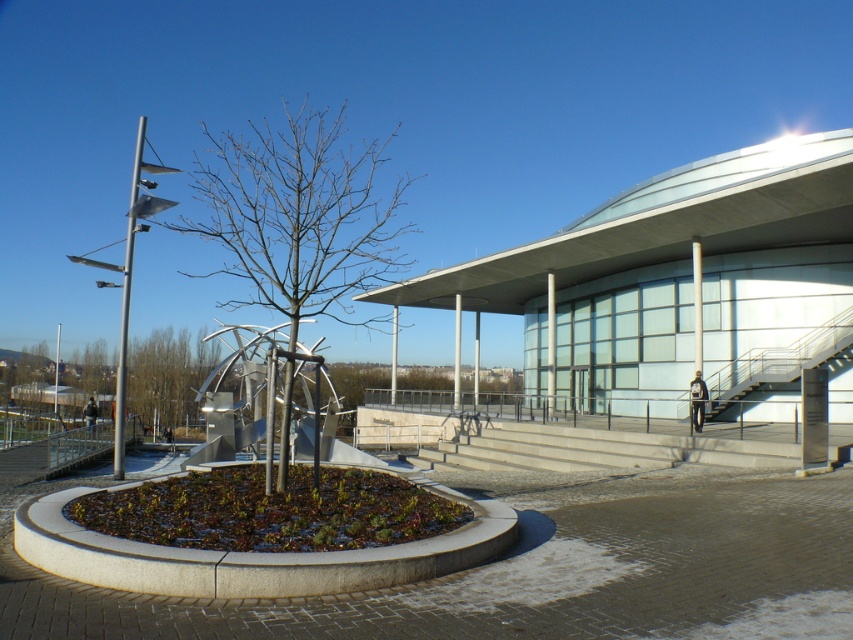
You are a maintenance worker needing to reach the roof of the building. You see the concrete stairs at center and the metallic gray staircase at right. Which staircase is closer to the roof?

The metallic gray staircase at right is closer to the roof since it is only 23.40 feet away from the concrete stairs at center, but the distance to the roof isn

You are an architect visiting the site and need to access the second floor. The metallic gray staircase at right is the only pathway. However, there is a bare branches at center blocking your path. Can you walk up the staircase without disturbing the branches?

The bare branches at center is positioned over the metallic gray staircase at right, so you cannot walk up the staircase without disturbing the branches.